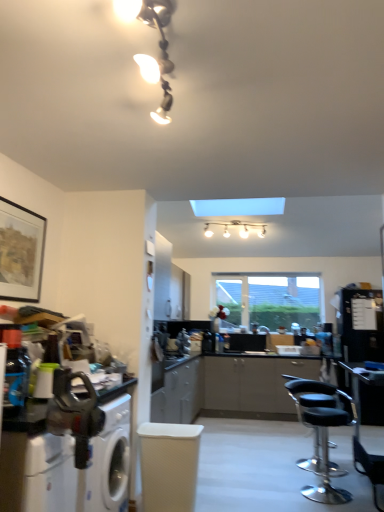
What do you see at coordinates (21, 252) in the screenshot? I see `matte black picture frame at upper left` at bounding box center [21, 252].

Find the location of a particular element. matte black picture frame at upper left is located at coordinates (21, 252).

In order to click on metallic glass light fixture at upper center in this screenshot , I will do `click(159, 46)`.

This screenshot has height=512, width=384. What do you see at coordinates (271, 300) in the screenshot?
I see `transparent glass window at center` at bounding box center [271, 300].

Locate an element on the screen. The height and width of the screenshot is (512, 384). black leather stool at lower right, placed as the second chair when sorted from right to left is located at coordinates (322, 430).

This screenshot has height=512, width=384. What are the coordinates of `white textured swivel chair at center` in the screenshot? It's located at (169, 465).

Locate an element on the screen. This screenshot has width=384, height=512. matte black picture frame at upper left is located at coordinates (21, 252).

From the image's perspective, between black leather stool at lower right, arranged as the first chair when viewed from the left, and metallic glass light fixture at upper center, which one is located above?

metallic glass light fixture at upper center, from the image's perspective.

Which of these two, black leather stool at lower right, arranged as the first chair when viewed from the left, or metallic glass light fixture at upper center, stands taller?

With more height is black leather stool at lower right, arranged as the first chair when viewed from the left.

Does point (316, 495) come farther from viewer compared to point (162, 60)?

That is True.

Which of these two, black leather chair at lower right, the 1th chair viewed from the right, or black leather stool at lower right, placed as the second chair when sorted from right to left, is wider?

Wider between the two is black leather stool at lower right, placed as the second chair when sorted from right to left.

Is black leather chair at lower right, which ranks as the second chair in left-to-right order, situated inside black leather stool at lower right, arranged as the first chair when viewed from the left, or outside?

black leather chair at lower right, which ranks as the second chair in left-to-right order, is not enclosed by black leather stool at lower right, arranged as the first chair when viewed from the left.

Locate an element on the screen. The width and height of the screenshot is (384, 512). chair on the right of black leather stool at lower right, arranged as the first chair when viewed from the left is located at coordinates (370, 468).

Is white textured swivel chair at center not close to transparent glass window at center?

Yes, white textured swivel chair at center and transparent glass window at center are located far from each other.

Who is shorter, white textured swivel chair at center or transparent glass window at center?

Standing shorter between the two is white textured swivel chair at center.

At what (x,y) coordinates should I click in order to perform the action: click on swivel chair to the left of transparent glass window at center. Please return your answer as a coordinate pair (x, y). Image resolution: width=384 pixels, height=512 pixels. Looking at the image, I should click on (169, 465).

Is transparent glass window at center at the back of white textured swivel chair at center?

No, white textured swivel chair at center's orientation is not away from transparent glass window at center.

Where is `countertop positioned vertically above the black leather stool at lower right, arranged as the first chair when viewed from the left (from a real-world perspective)`? The width and height of the screenshot is (384, 512). countertop positioned vertically above the black leather stool at lower right, arranged as the first chair when viewed from the left (from a real-world perspective) is located at coordinates (65, 460).

How distant is metallic silver countertop at lower left from black leather stool at lower right, arranged as the first chair when viewed from the left?

metallic silver countertop at lower left is 1.99 meters from black leather stool at lower right, arranged as the first chair when viewed from the left.

Is metallic silver countertop at lower left positioned with its back to black leather stool at lower right, placed as the second chair when sorted from right to left?

No, metallic silver countertop at lower left's orientation is not away from black leather stool at lower right, placed as the second chair when sorted from right to left.

Based on the photo, considering the sizes of metallic silver countertop at lower left and black leather stool at lower right, arranged as the first chair when viewed from the left, in the image, is metallic silver countertop at lower left taller or shorter than black leather stool at lower right, arranged as the first chair when viewed from the left,?

Clearly, metallic silver countertop at lower left is taller compared to black leather stool at lower right, arranged as the first chair when viewed from the left.

Where is `chair to the right of transparent glass window at center`? This screenshot has height=512, width=384. chair to the right of transparent glass window at center is located at coordinates (370, 468).

From a real-world perspective, is black leather chair at lower right, which ranks as the second chair in left-to-right order, on top of transparent glass window at center?

No, from a real-world perspective, black leather chair at lower right, which ranks as the second chair in left-to-right order, is not on top of transparent glass window at center.

From a real-world perspective, relative to black leather chair at lower right, the 1th chair viewed from the right, is white glossy light fixture at upper center vertically above or below?

Clearly, from a real-world perspective, white glossy light fixture at upper center is above black leather chair at lower right, the 1th chair viewed from the right.

Is white glossy light fixture at upper center far from black leather chair at lower right, which ranks as the second chair in left-to-right order?

Indeed, white glossy light fixture at upper center is not near black leather chair at lower right, which ranks as the second chair in left-to-right order.

Could you tell me if white glossy light fixture at upper center is turned towards black leather chair at lower right, the 1th chair viewed from the right?

No.

Is the depth of transparent glass window at center greater than that of black leather stool at lower right, placed as the second chair when sorted from right to left?

Yes, the depth of transparent glass window at center is greater than that of black leather stool at lower right, placed as the second chair when sorted from right to left.

From the image's perspective, who appears lower, transparent glass window at center or black leather stool at lower right, placed as the second chair when sorted from right to left?

black leather stool at lower right, placed as the second chair when sorted from right to left, appears lower in the image.

From the picture: From a real-world perspective, which object rests below the other?

In real-world perspective, black leather stool at lower right, placed as the second chair when sorted from right to left, is lower.

Image resolution: width=384 pixels, height=512 pixels. I want to click on light fixture that appears above the black leather stool at lower right, placed as the second chair when sorted from right to left (from the image's perspective), so click(x=159, y=46).

Locate an element on the screen. chair below the black leather stool at lower right, arranged as the first chair when viewed from the left (from a real-world perspective) is located at coordinates (370, 468).

From the picture: Estimate the real-world distances between objects in this image. Which object is further from metallic silver countertop at lower left, transparent glass window at center or black leather stool at lower right, placed as the second chair when sorted from right to left?

The object further to metallic silver countertop at lower left is transparent glass window at center.

Based on their spatial positions, is metallic silver countertop at lower left or white glossy light fixture at upper center further from matte black picture frame at upper left?

white glossy light fixture at upper center is further to matte black picture frame at upper left.

Which object lies nearer to the anchor point transparent glass window at center, black leather chair at lower right, the 1th chair viewed from the right, or metallic silver countertop at lower left?

black leather chair at lower right, the 1th chair viewed from the right, is closer to transparent glass window at center.

Estimate the real-world distances between objects in this image. Which object is closer to transparent glass window at center, metallic silver countertop at lower left or black leather stool at lower right, placed as the second chair when sorted from right to left?

Among the two, black leather stool at lower right, placed as the second chair when sorted from right to left, is located nearer to transparent glass window at center.

Estimate the real-world distances between objects in this image. Which object is closer to matte black picture frame at upper left, white textured swivel chair at center or transparent glass window at center?

white textured swivel chair at center is positioned closer to the anchor matte black picture frame at upper left.

When comparing their distances from white textured swivel chair at center, does matte black picture frame at upper left or transparent glass window at center seem further?

transparent glass window at center is positioned further to the anchor white textured swivel chair at center.

Based on their spatial positions, is white glossy light fixture at upper center or matte black picture frame at upper left closer to black leather chair at lower right, which ranks as the second chair in left-to-right order?

matte black picture frame at upper left is closer to black leather chair at lower right, which ranks as the second chair in left-to-right order.

From the image, which object appears to be nearer to white glossy light fixture at upper center, matte black picture frame at upper left or white textured swivel chair at center?

The object closer to white glossy light fixture at upper center is matte black picture frame at upper left.

This screenshot has width=384, height=512. What are the coordinates of `swivel chair between matte black picture frame at upper left and black leather stool at lower right, placed as the second chair when sorted from right to left, in the horizontal direction` in the screenshot? It's located at (169, 465).

At what (x,y) coordinates should I click in order to perform the action: click on countertop situated between matte black picture frame at upper left and black leather stool at lower right, placed as the second chair when sorted from right to left, from left to right. Please return your answer as a coordinate pair (x, y). This screenshot has height=512, width=384. Looking at the image, I should click on (65, 460).

The image size is (384, 512). Identify the location of swivel chair between metallic glass light fixture at upper center and black leather stool at lower right, placed as the second chair when sorted from right to left, in the vertical direction. (169, 465).

I want to click on lamp positioned between metallic glass light fixture at upper center and transparent glass window at center from near to far, so click(236, 226).